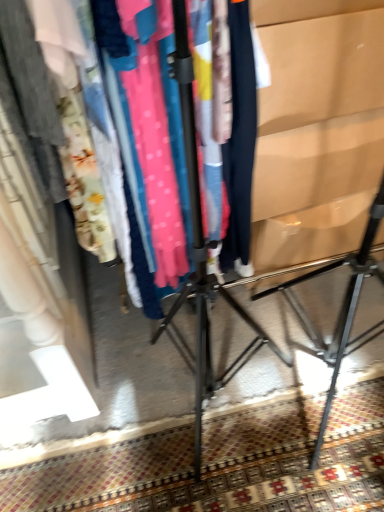
Question: Considering the relative positions of matte cardboard at right and carpeted floor at lower center in the image provided, is matte cardboard at right behind carpeted floor at lower center?

Choices:
 (A) no
 (B) yes

Answer: (A)

Question: Considering the relative sizes of matte cardboard at right and carpeted floor at lower center in the image provided, is matte cardboard at right smaller than carpeted floor at lower center?

Choices:
 (A) yes
 (B) no

Answer: (B)

Question: Considering the relative sizes of matte cardboard at right and carpeted floor at lower center in the image provided, is matte cardboard at right shorter than carpeted floor at lower center?

Choices:
 (A) no
 (B) yes

Answer: (A)

Question: Is matte cardboard at right taller than carpeted floor at lower center?

Choices:
 (A) no
 (B) yes

Answer: (B)

Question: Is matte cardboard at right positioned before carpeted floor at lower center?

Choices:
 (A) yes
 (B) no

Answer: (A)

Question: In terms of height, does matte black clothing rack at center look taller or shorter compared to carpeted floor at lower center?

Choices:
 (A) tall
 (B) short

Answer: (A)

Question: Is matte black clothing rack at center bigger or smaller than carpeted floor at lower center?

Choices:
 (A) small
 (B) big

Answer: (B)

Question: From a real-world perspective, is matte black clothing rack at center positioned above or below carpeted floor at lower center?

Choices:
 (A) above
 (B) below

Answer: (A)

Question: Would you say matte black clothing rack at center is inside or outside carpeted floor at lower center?

Choices:
 (A) outside
 (B) inside

Answer: (A)

Question: From a real-world perspective, is carpeted floor at lower center physically located above or below matte black clothing rack at center?

Choices:
 (A) above
 (B) below

Answer: (B)

Question: Considering the positions of carpeted floor at lower center and matte black clothing rack at center in the image, is carpeted floor at lower center taller or shorter than matte black clothing rack at center?

Choices:
 (A) tall
 (B) short

Answer: (B)

Question: From the image's perspective, relative to matte black clothing rack at center, is carpeted floor at lower center above or below?

Choices:
 (A) above
 (B) below

Answer: (B)

Question: Is carpeted floor at lower center inside or outside of matte black clothing rack at center?

Choices:
 (A) outside
 (B) inside

Answer: (A)

Question: Is matte cardboard at right taller or shorter than carpeted floor at lower center?

Choices:
 (A) short
 (B) tall

Answer: (B)

Question: Considering the positions of point (324, 351) and point (279, 426), is point (324, 351) closer or farther from the camera than point (279, 426)?

Choices:
 (A) farther
 (B) closer

Answer: (A)